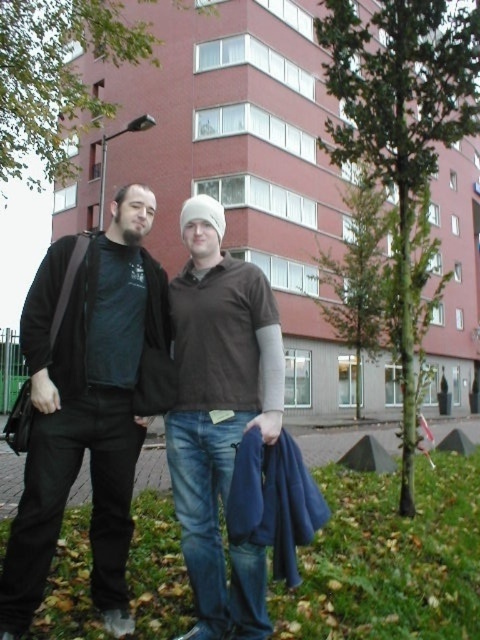
Question: Which point is farther to the camera?

Choices:
 (A) (132, 353)
 (B) (251, 612)

Answer: (A)

Question: Is black matte jacket at left closer to camera compared to brown cotton shirt at center?

Choices:
 (A) no
 (B) yes

Answer: (B)

Question: Which point appears farthest from the camera in this image?

Choices:
 (A) (144, 212)
 (B) (213, 500)

Answer: (A)

Question: Which point is farther to the camera?

Choices:
 (A) (196, 218)
 (B) (19, 522)

Answer: (A)

Question: Does black matte jacket at left appear over brown cotton shirt at center?

Choices:
 (A) no
 (B) yes

Answer: (B)

Question: Does black matte jacket at left lie in front of brown cotton shirt at center?

Choices:
 (A) no
 (B) yes

Answer: (B)